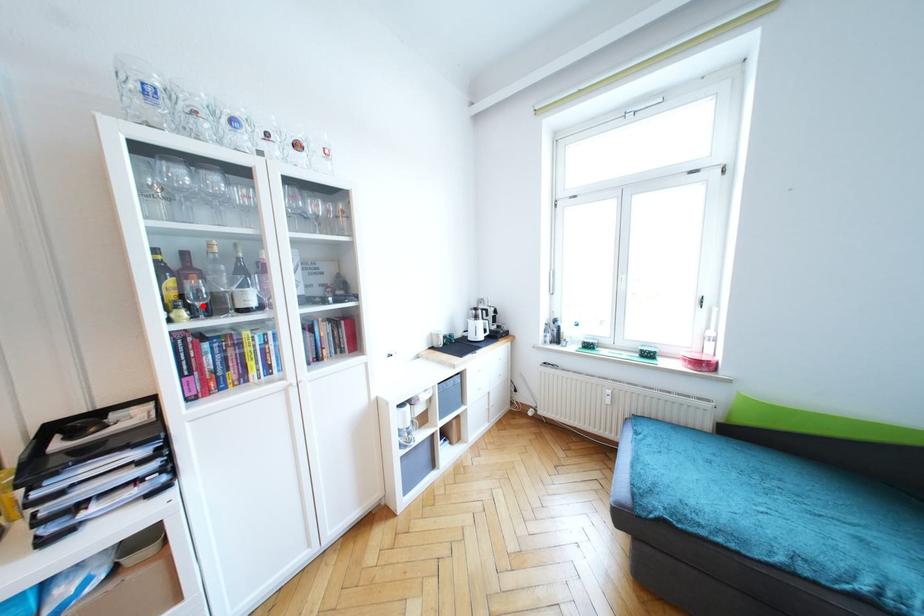
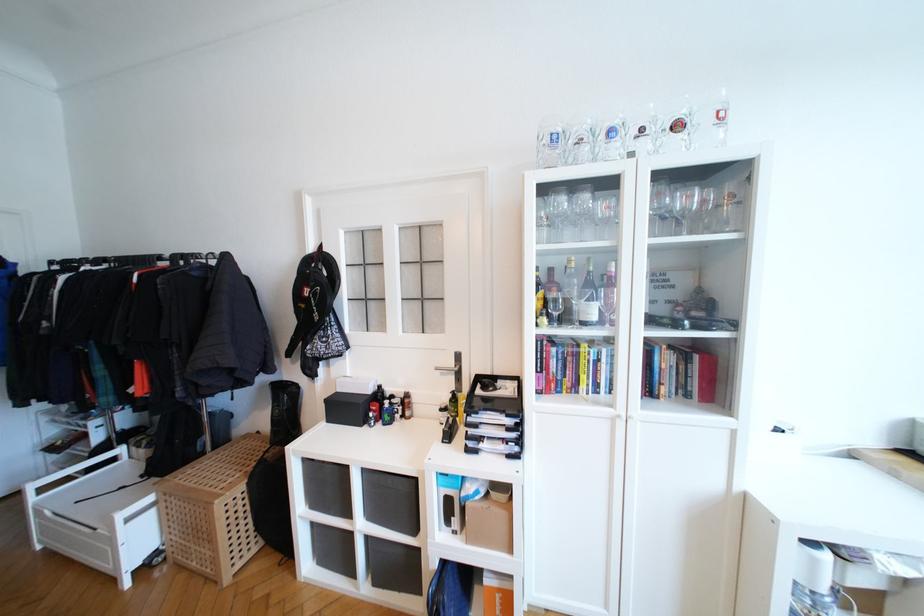
Find the pixel in the second image that matches the highlighted location in the first image.

(558, 315)